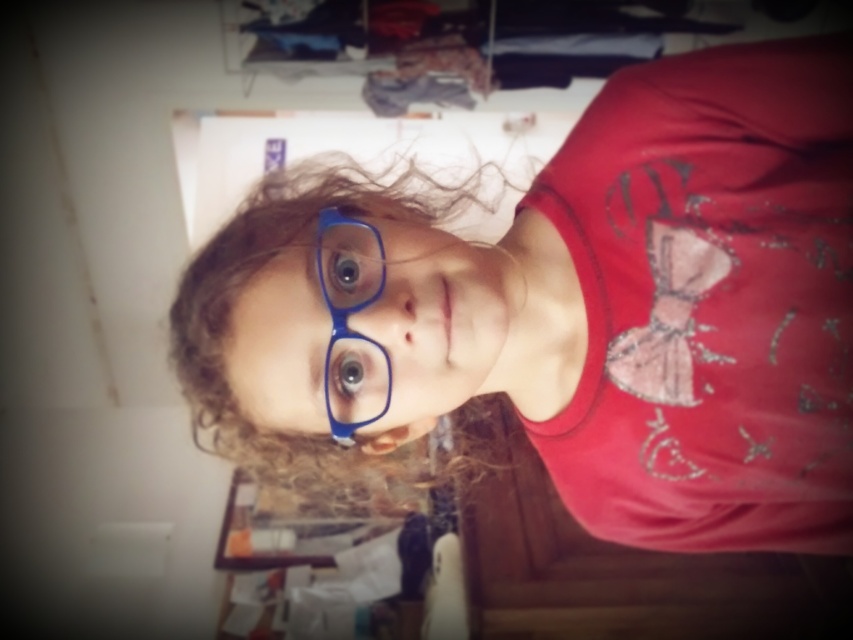
You are trying to determine if the matte blue glasses at center can be placed on top of the curly brown hair at center without overlapping. Based on their widths, is this possible?

The matte blue glasses at center are wider than the curly brown hair at center, so placing them on top would cause overlapping since the glasses are wider.

You are trying to locate the matte blue glasses at center in the image. What are their coordinates?

The matte blue glasses at center are located at coordinates point (573, 312).